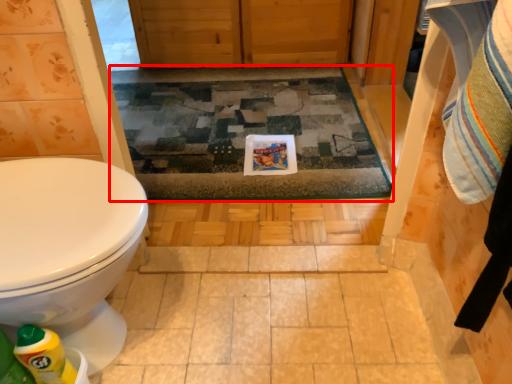
Question: Where is bath mat (annotated by the red box) located in relation to cleaning product in the image?

Choices:
 (A) left
 (B) right

Answer: (B)